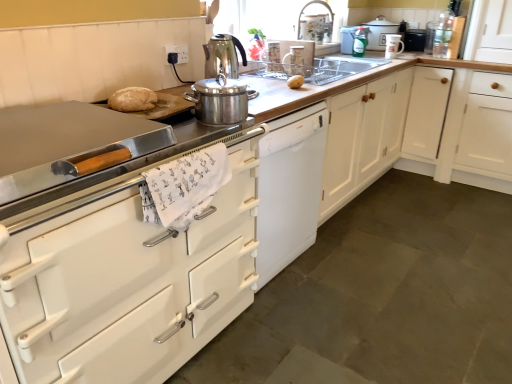
This screenshot has width=512, height=384. Identify the location of free space in front of clear glass sink at center. [281, 83].